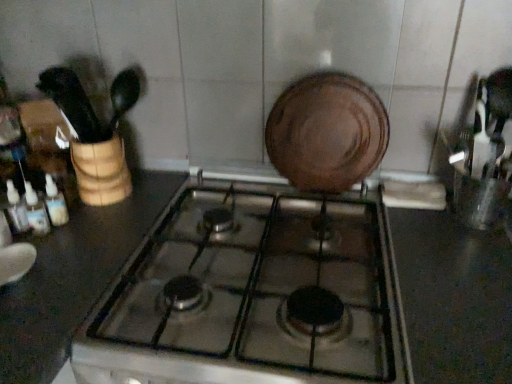
The image size is (512, 384). What do you see at coordinates (253, 297) in the screenshot?
I see `metallic glass gas stove at center` at bounding box center [253, 297].

The height and width of the screenshot is (384, 512). Identify the location of translucent plastic bottles at left, the 1th bottle when ordered from left to right. (16, 209).

Image resolution: width=512 pixels, height=384 pixels. Describe the element at coordinates (16, 209) in the screenshot. I see `translucent plastic bottles at left, which is the third bottle from right to left` at that location.

Describe the element at coordinates (454, 298) in the screenshot. I see `black glossy countertop at center` at that location.

This screenshot has width=512, height=384. In order to click on metallic glass gas stove at center in this screenshot , I will do `click(253, 297)`.

Who is taller, brown matte plate at center or black glossy countertop at center?

black glossy countertop at center.

Considering the relative sizes of brown matte plate at center and black glossy countertop at center in the image provided, is brown matte plate at center smaller than black glossy countertop at center?

Yes, brown matte plate at center is smaller than black glossy countertop at center.

Is brown matte plate at center aimed at black glossy countertop at center?

No, brown matte plate at center is not turned towards black glossy countertop at center.

From the image's perspective, which one is positioned lower, brown matte plate at center or black glossy countertop at center?

black glossy countertop at center.

Based on the photo, is translucent plastic bottles at left, which is the third bottle from right to left, not inside metallic glass gas stove at center?

Indeed, translucent plastic bottles at left, which is the third bottle from right to left, is completely outside metallic glass gas stove at center.

Based on the photo, does translucent plastic bottles at left, which is the third bottle from right to left, turn towards metallic glass gas stove at center?

Yes, translucent plastic bottles at left, which is the third bottle from right to left, is turned towards metallic glass gas stove at center.

From the picture: Which of these two, translucent plastic bottles at left, the 1th bottle when ordered from left to right, or metallic glass gas stove at center, stands shorter?

Standing shorter between the two is translucent plastic bottles at left, the 1th bottle when ordered from left to right.

From the image's perspective, who appears lower, translucent plastic bottles at left, the 3th bottle when ordered from left to right, or brown matte plate at center?

translucent plastic bottles at left, the 3th bottle when ordered from left to right, is shown below in the image.

From a real-world perspective, which is physically below, translucent plastic bottles at left, placed as the first bottle when sorted from right to left, or brown matte plate at center?

In real-world perspective, translucent plastic bottles at left, placed as the first bottle when sorted from right to left, is lower.

Who is more distant, translucent plastic bottles at left, the 3th bottle when ordered from left to right, or brown matte plate at center?

brown matte plate at center is more distant.

Find the location of a particular element. The height and width of the screenshot is (384, 512). kitchen appliance that appears above the translucent plastic bottles at left, the 3th bottle when ordered from left to right (from the image's perspective) is located at coordinates (327, 132).

Is translucent plastic bottles at left, placed as the first bottle when sorted from right to left, in contact with translucent plastic bottles at left, which appears as the second bottle when viewed from the right?

Yes, translucent plastic bottles at left, placed as the first bottle when sorted from right to left, is in contact with translucent plastic bottles at left, which appears as the second bottle when viewed from the right.

Is translucent plastic bottles at left, placed as the first bottle when sorted from right to left, further to camera compared to translucent plastic bottles at left, which appears as the second bottle when viewed from the right?

Yes, translucent plastic bottles at left, placed as the first bottle when sorted from right to left, is further from the camera.

Where is `bottle on the right of translucent plastic bottles at left, which appears as the second bottle when viewed from the right`? The height and width of the screenshot is (384, 512). bottle on the right of translucent plastic bottles at left, which appears as the second bottle when viewed from the right is located at coordinates (55, 203).

Looking at this image, is translucent plastic bottles at left, the 3th bottle when ordered from left to right, positioned beyond the bounds of translucent plastic bottles at left, which appears as the second bottle when viewed from the right?

Yes.

Considering the positions of point (161, 247) and point (357, 134), is point (161, 247) closer or farther from the camera than point (357, 134)?

Point (161, 247) appears to be closer to the viewer than point (357, 134).

Which of these two, metallic glass gas stove at center or brown matte plate at center, is smaller?

brown matte plate at center.

Is metallic glass gas stove at center at the right side of brown matte plate at center?

In fact, metallic glass gas stove at center is to the left of brown matte plate at center.

Based on the photo, could you tell me if translucent plastic bottles at left, the 3th bottle when ordered from left to right, is facing black glossy countertop at center?

Yes, translucent plastic bottles at left, the 3th bottle when ordered from left to right, is turned towards black glossy countertop at center.

Is translucent plastic bottles at left, placed as the first bottle when sorted from right to left, with black glossy countertop at center?

No, translucent plastic bottles at left, placed as the first bottle when sorted from right to left, is not with black glossy countertop at center.

Which is more to the right, translucent plastic bottles at left, the 3th bottle when ordered from left to right, or black glossy countertop at center?

black glossy countertop at center is more to the right.

Where is `kitchen appliance above the black glossy countertop at center (from the image's perspective)`? This screenshot has height=384, width=512. kitchen appliance above the black glossy countertop at center (from the image's perspective) is located at coordinates (327, 132).

Is black glossy countertop at center completely or partially outside of brown matte plate at center?

Yes.

Is black glossy countertop at center closer to camera compared to brown matte plate at center?

Yes, black glossy countertop at center is in front of brown matte plate at center.

Looking at the image, does black glossy countertop at center seem bigger or smaller compared to brown matte plate at center?

black glossy countertop at center is bigger than brown matte plate at center.

At what (x,y) coordinates should I click in order to perform the action: click on counter top in front of the brown matte plate at center. Please return your answer as a coordinate pair (x, y). Image resolution: width=512 pixels, height=384 pixels. Looking at the image, I should click on (x=454, y=298).

From a real-world perspective, count 2nd bottles upward from the metallic glass gas stove at center and point to it. Please provide its 2D coordinates.

[(16, 209)]

Which object lies nearer to the anchor point translucent plastic bottles at left, the 1th bottle when ordered from left to right, translucent plastic bottles at left, which appears as the second bottle when viewed from the right, or brown matte plate at center?

translucent plastic bottles at left, which appears as the second bottle when viewed from the right, is positioned closer to the anchor translucent plastic bottles at left, the 1th bottle when ordered from left to right.

Looking at this image, looking at the image, which one is located closer to translucent plastic bottles at left, the 3th bottle when ordered from left to right, brown matte plate at center or translucent plastic bottles at left, which is the third bottle from right to left?

translucent plastic bottles at left, which is the third bottle from right to left.

Which object lies nearer to the anchor point translucent plastic bottles at left, the 2th bottle positioned from the left, translucent plastic bottles at left, the 3th bottle when ordered from left to right, or brown matte plate at center?

Based on the image, translucent plastic bottles at left, the 3th bottle when ordered from left to right, appears to be nearer to translucent plastic bottles at left, the 2th bottle positioned from the left.

Looking at the image, which one is located closer to translucent plastic bottles at left, which is the third bottle from right to left, brown matte plate at center or metallic glass gas stove at center?

Based on the image, metallic glass gas stove at center appears to be nearer to translucent plastic bottles at left, which is the third bottle from right to left.

Based on their spatial positions, is translucent plastic bottles at left, placed as the first bottle when sorted from right to left, or brown matte plate at center further from translucent plastic bottles at left, the 1th bottle when ordered from left to right?

The object further to translucent plastic bottles at left, the 1th bottle when ordered from left to right, is brown matte plate at center.

When comparing their distances from translucent plastic bottles at left, which appears as the second bottle when viewed from the right, does black glossy countertop at center or translucent plastic bottles at left, the 3th bottle when ordered from left to right, seem further?

The object further to translucent plastic bottles at left, which appears as the second bottle when viewed from the right, is black glossy countertop at center.

Consider the image. Which object lies further to the anchor point translucent plastic bottles at left, which appears as the second bottle when viewed from the right, brown matte plate at center or black glossy countertop at center?

black glossy countertop at center.

When comparing their distances from metallic glass gas stove at center, does brown matte plate at center or translucent plastic bottles at left, which appears as the second bottle when viewed from the right, seem closer?

brown matte plate at center lies closer to metallic glass gas stove at center than the other object.

What are the coordinates of `gas stove between translucent plastic bottles at left, which is the third bottle from right to left, and brown matte plate at center` in the screenshot? It's located at (253, 297).

Find the location of a particular element. gas stove between brown matte plate at center and black glossy countertop at center from top to bottom is located at coordinates (253, 297).

At what (x,y) coordinates should I click in order to perform the action: click on gas stove between translucent plastic bottles at left, placed as the first bottle when sorted from right to left, and black glossy countertop at center, in the horizontal direction. Please return your answer as a coordinate pair (x, y). Image resolution: width=512 pixels, height=384 pixels. Looking at the image, I should click on (253, 297).

In order to click on bottle between translucent plastic bottles at left, which appears as the second bottle when viewed from the right, and metallic glass gas stove at center, in the horizontal direction in this screenshot , I will do `click(55, 203)`.